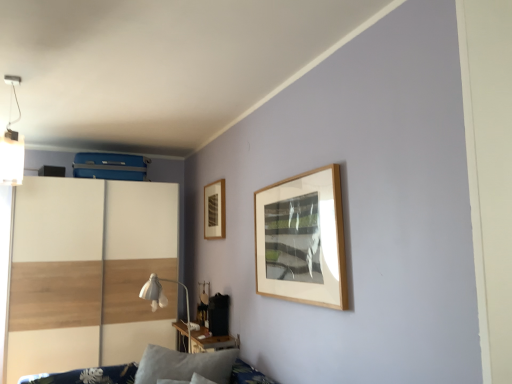
Question: From the image's perspective, does gray fabric pillow at lower left appear lower than wooden picture frame at upper left?

Choices:
 (A) yes
 (B) no

Answer: (A)

Question: From a real-world perspective, is gray fabric pillow at lower left under wooden picture frame at upper left?

Choices:
 (A) yes
 (B) no

Answer: (A)

Question: From the image's perspective, does gray fabric pillow at lower left appear higher than wooden picture frame at upper left?

Choices:
 (A) yes
 (B) no

Answer: (B)

Question: Is gray fabric pillow at lower left to the left of wooden picture frame at upper left from the viewer's perspective?

Choices:
 (A) no
 (B) yes

Answer: (B)

Question: Are gray fabric pillow at lower left and wooden picture frame at upper left located far from each other?

Choices:
 (A) yes
 (B) no

Answer: (A)

Question: Considering the relative positions of wooden picture frame at upper left and white matte light fixture at upper left in the image provided, is wooden picture frame at upper left to the left or to the right of white matte light fixture at upper left?

Choices:
 (A) right
 (B) left

Answer: (A)

Question: Is wooden picture frame at upper left wider or thinner than white matte light fixture at upper left?

Choices:
 (A) thin
 (B) wide

Answer: (A)

Question: Is wooden picture frame at upper left spatially inside white matte light fixture at upper left, or outside of it?

Choices:
 (A) inside
 (B) outside

Answer: (B)

Question: From the image's perspective, is wooden picture frame at upper left located above or below white matte light fixture at upper left?

Choices:
 (A) below
 (B) above

Answer: (A)

Question: Considering the positions of point (156, 367) and point (181, 337), is point (156, 367) closer or farther from the camera than point (181, 337)?

Choices:
 (A) closer
 (B) farther

Answer: (A)

Question: Looking at their shapes, would you say gray fabric pillow at lower left is wider or thinner than wooden table at lower center?

Choices:
 (A) wide
 (B) thin

Answer: (A)

Question: In terms of size, does gray fabric pillow at lower left appear bigger or smaller than wooden table at lower center?

Choices:
 (A) small
 (B) big

Answer: (B)

Question: In the image, is gray fabric pillow at lower left positioned in front of or behind wooden table at lower center?

Choices:
 (A) front
 (B) behind

Answer: (A)

Question: Is point (148, 291) closer or farther from the camera than point (131, 374)?

Choices:
 (A) farther
 (B) closer

Answer: (A)

Question: From a real-world perspective, is white fabric table lamp at center positioned above or below blue fabric sofa at lower left?

Choices:
 (A) above
 (B) below

Answer: (A)